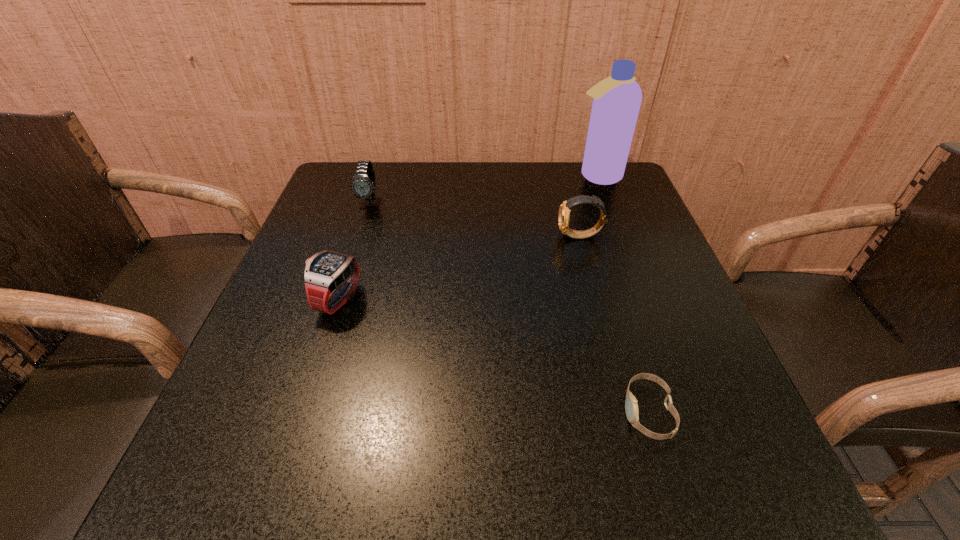
In order to click on vacant space located on the face of the third nearest object in this screenshot , I will do `click(454, 237)`.

I want to click on free spot located 0.180m on the face of the third nearest object, so click(x=480, y=237).

Locate an element on the screen. vacant space located 0.230m on the back of the fourth farthest object is located at coordinates (366, 214).

Locate an element on the screen. free space located on the face of the nearest watch is located at coordinates (561, 412).

Locate an element on the screen. free space located 0.400m on the face of the nearest watch is located at coordinates (370, 412).

You are a GUI agent. You are given a task and a screenshot of the screen. Output one action in this format:
    pyautogui.click(x=<x>, y=<y>)
    Task: Click on the free space located on the face of the nearest watch
    The height and width of the screenshot is (540, 960).
    Given the screenshot: What is the action you would take?
    pyautogui.click(x=529, y=412)

Find the location of `shampoo that is positioned at the far edge`. shampoo that is positioned at the far edge is located at coordinates (617, 99).

Locate an element on the screen. watch that is at the far edge is located at coordinates (363, 185).

Locate an element on the screen. This screenshot has width=960, height=540. shampoo that is positioned at the right edge is located at coordinates (617, 99).

You are a GUI agent. You are given a task and a screenshot of the screen. Output one action in this format:
    pyautogui.click(x=<x>, y=<y>)
    Task: Click on the object that is at the far left corner
    This screenshot has width=960, height=540.
    Given the screenshot: What is the action you would take?
    pyautogui.click(x=363, y=185)